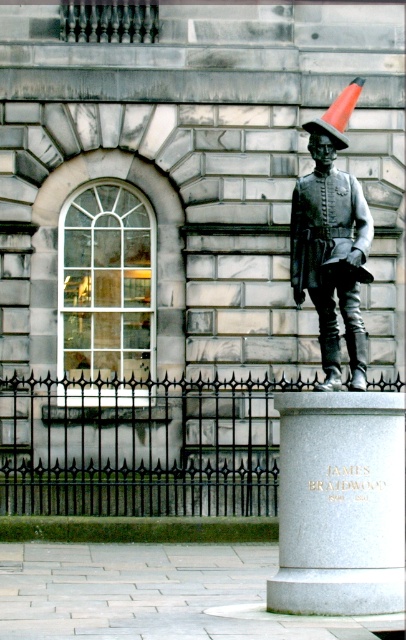
You are a tour guide explaining the statue to visitors. Pointing to the polished bronze statue at right, you want to mention its exact location in the image. What coordinates should you state?

The polished bronze statue at right is located at coordinates point (336, 412).

You are an art conservator assessing the space between the polished bronze statue at right and the bronze metallic uniform at center. Can you determine if the statue is wider than the uniform?

The polished bronze statue at right might be wider than bronze metallic uniform at center according to the description.

In the scene shown: You are a photographer taking a picture of the statue. You notice two points on the pedestal. One is at coordinate point (319, 436) and the other is at coordinate point (328, 369). Which point will appear larger in your photo?

Point (319, 436) is closer to the camera than point (328, 369), so it will appear larger in the photo.